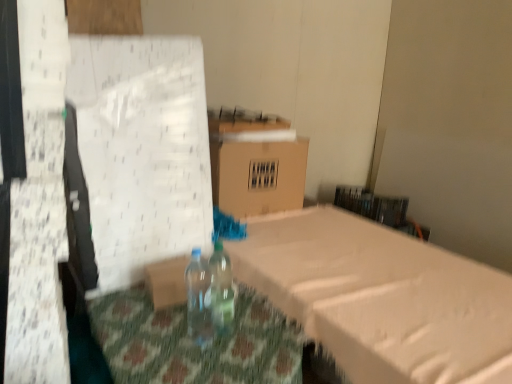
Identify the location of vacant area to the right of transparent plastic bottle at center, the first bottle when ordered from right to left. (258, 339).